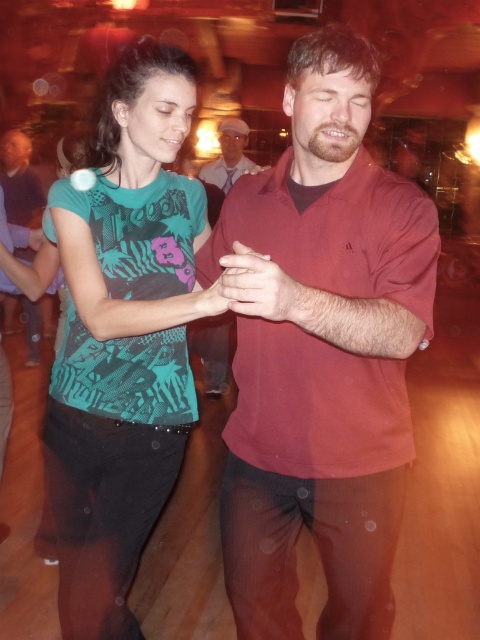
Question: Among these objects, which one is nearest to the camera?

Choices:
 (A) pink fabric hat at upper center
 (B) matte red shirt at center
 (C) matte black shirt at left
 (D) teal printed t-shirt at center

Answer: (B)

Question: Based on their relative distances, which object is farther from the matte red shirt at center?

Choices:
 (A) pink fabric hat at upper center
 (B) matte black shirt at left
 (C) teal printed t-shirt at center

Answer: (B)

Question: From the image, what is the correct spatial relationship of matte red shirt at center in relation to matte black shirt at left?

Choices:
 (A) left
 (B) right

Answer: (B)

Question: Does matte red shirt at center appear on the right side of teal printed t-shirt at center?

Choices:
 (A) no
 (B) yes

Answer: (B)

Question: Estimate the real-world distances between objects in this image. Which object is farther from the matte red shirt at center?

Choices:
 (A) matte black shirt at left
 (B) teal printed t-shirt at center

Answer: (A)

Question: Can you confirm if matte red shirt at center is thinner than pink fabric hat at upper center?

Choices:
 (A) no
 (B) yes

Answer: (A)